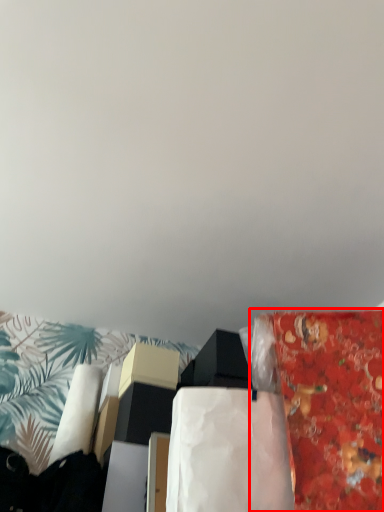
Question: From the image, what is the correct spatial relationship of material (annotated by the red box) in relation to blanket?

Choices:
 (A) left
 (B) right

Answer: (B)